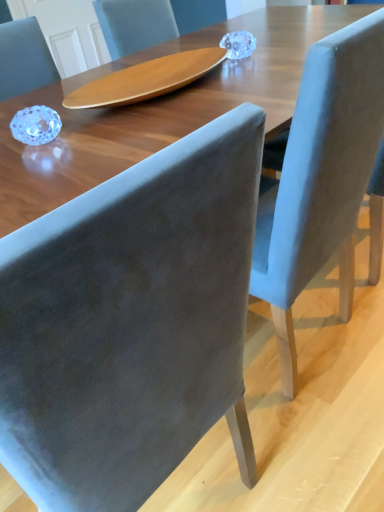
What do you see at coordinates (321, 178) in the screenshot?
I see `velvet blue chair at center, which ranks as the second chair in left-to-right order` at bounding box center [321, 178].

The height and width of the screenshot is (512, 384). What are the coordinates of `velvet blue chair at center, marked as the 1th chair in a right-to-left arrangement` in the screenshot? It's located at (321, 178).

The height and width of the screenshot is (512, 384). What do you see at coordinates (129, 321) in the screenshot?
I see `velvet gray chair at center, which is the 2th chair in right-to-left order` at bounding box center [129, 321].

This screenshot has height=512, width=384. I want to click on velvet gray chair at center, the 1th chair from the left, so click(x=129, y=321).

Where is `velvet blue chair at center, marked as the 1th chair in a right-to-left arrangement`? velvet blue chair at center, marked as the 1th chair in a right-to-left arrangement is located at coordinates (321, 178).

Which object is positioned more to the right, velvet blue chair at center, which ranks as the second chair in left-to-right order, or velvet gray chair at center, the 1th chair from the left?

From the viewer's perspective, velvet blue chair at center, which ranks as the second chair in left-to-right order, appears more on the right side.

Is the depth of velvet blue chair at center, which ranks as the second chair in left-to-right order, greater than that of velvet gray chair at center, the 1th chair from the left?

Yes, the depth of velvet blue chair at center, which ranks as the second chair in left-to-right order, is greater than that of velvet gray chair at center, the 1th chair from the left.

Is point (283, 249) positioned before point (88, 342)?

No, (283, 249) is further to viewer.

From the image's perspective, does velvet blue chair at center, which ranks as the second chair in left-to-right order, appear lower than velvet gray chair at center, the 1th chair from the left?

Actually, velvet blue chair at center, which ranks as the second chair in left-to-right order, appears above velvet gray chair at center, the 1th chair from the left, in the image.

From a real-world perspective, is velvet blue chair at center, which ranks as the second chair in left-to-right order, located beneath velvet gray chair at center, the 1th chair from the left?

Yes, from a real-world perspective, velvet blue chair at center, which ranks as the second chair in left-to-right order, is below velvet gray chair at center, the 1th chair from the left.

Which object is thinner, velvet blue chair at center, marked as the 1th chair in a right-to-left arrangement, or velvet gray chair at center, the 1th chair from the left?

velvet blue chair at center, marked as the 1th chair in a right-to-left arrangement.

Between velvet blue chair at center, which ranks as the second chair in left-to-right order, and velvet gray chair at center, which is the 2th chair in right-to-left order, which one has less height?

With less height is velvet blue chair at center, which ranks as the second chair in left-to-right order.

In terms of size, does velvet blue chair at center, which ranks as the second chair in left-to-right order, appear bigger or smaller than velvet gray chair at center, which is the 2th chair in right-to-left order?

Clearly, velvet blue chair at center, which ranks as the second chair in left-to-right order, is larger in size than velvet gray chair at center, which is the 2th chair in right-to-left order.

Would you say velvet blue chair at center, which ranks as the second chair in left-to-right order, is inside or outside velvet gray chair at center, the 1th chair from the left?

velvet blue chair at center, which ranks as the second chair in left-to-right order, is outside velvet gray chair at center, the 1th chair from the left.

Is velvet blue chair at center, marked as the 1th chair in a right-to-left arrangement, touching velvet gray chair at center, which is the 2th chair in right-to-left order?

No, velvet blue chair at center, marked as the 1th chair in a right-to-left arrangement, is not next to velvet gray chair at center, which is the 2th chair in right-to-left order.

Does velvet blue chair at center, which ranks as the second chair in left-to-right order, turn towards velvet gray chair at center, the 1th chair from the left?

No, velvet blue chair at center, which ranks as the second chair in left-to-right order, is not oriented towards velvet gray chair at center, the 1th chair from the left.

How different are the orientations of velvet blue chair at center, marked as the 1th chair in a right-to-left arrangement, and velvet gray chair at center, the 1th chair from the left, in degrees?

The facing directions of velvet blue chair at center, marked as the 1th chair in a right-to-left arrangement, and velvet gray chair at center, the 1th chair from the left, are 0.000313 degrees apart.

This screenshot has width=384, height=512. Find the location of `chair on the left of velvet blue chair at center, marked as the 1th chair in a right-to-left arrangement`. chair on the left of velvet blue chair at center, marked as the 1th chair in a right-to-left arrangement is located at coordinates (129, 321).

Which object is positioned more to the right, velvet gray chair at center, which is the 2th chair in right-to-left order, or velvet blue chair at center, which ranks as the second chair in left-to-right order?

From the viewer's perspective, velvet blue chair at center, which ranks as the second chair in left-to-right order, appears more on the right side.

Does velvet gray chair at center, which is the 2th chair in right-to-left order, come behind velvet blue chair at center, marked as the 1th chair in a right-to-left arrangement?

No, it is in front of velvet blue chair at center, marked as the 1th chair in a right-to-left arrangement.

Which is in front, point (117, 271) or point (382, 40)?

Point (117, 271)

From the image's perspective, does velvet gray chair at center, which is the 2th chair in right-to-left order, appear lower than velvet blue chair at center, marked as the 1th chair in a right-to-left arrangement?

Indeed, from the image's perspective, velvet gray chair at center, which is the 2th chair in right-to-left order, is shown beneath velvet blue chair at center, marked as the 1th chair in a right-to-left arrangement.

From a real-world perspective, is velvet gray chair at center, the 1th chair from the left, on velvet blue chair at center, marked as the 1th chair in a right-to-left arrangement?

Indeed, from a real-world perspective, velvet gray chair at center, the 1th chair from the left, stands above velvet blue chair at center, marked as the 1th chair in a right-to-left arrangement.

Considering the relative sizes of velvet gray chair at center, the 1th chair from the left, and velvet blue chair at center, marked as the 1th chair in a right-to-left arrangement, in the image provided, is velvet gray chair at center, the 1th chair from the left, wider than velvet blue chair at center, marked as the 1th chair in a right-to-left arrangement,?

Correct, the width of velvet gray chair at center, the 1th chair from the left, exceeds that of velvet blue chair at center, marked as the 1th chair in a right-to-left arrangement.

Between velvet gray chair at center, which is the 2th chair in right-to-left order, and velvet blue chair at center, which ranks as the second chair in left-to-right order, which one has less height?

Standing shorter between the two is velvet blue chair at center, which ranks as the second chair in left-to-right order.

Who is smaller, velvet gray chair at center, the 1th chair from the left, or velvet blue chair at center, which ranks as the second chair in left-to-right order?

Smaller between the two is velvet gray chair at center, the 1th chair from the left.

Is velvet gray chair at center, the 1th chair from the left, outside of velvet blue chair at center, which ranks as the second chair in left-to-right order?

velvet gray chair at center, the 1th chair from the left, is positioned outside velvet blue chair at center, which ranks as the second chair in left-to-right order.

Is velvet gray chair at center, the 1th chair from the left, not close to velvet blue chair at center, which ranks as the second chair in left-to-right order?

They are positioned close to each other.

Is velvet gray chair at center, which is the 2th chair in right-to-left order, positioned with its back to velvet blue chair at center, which ranks as the second chair in left-to-right order?

No, velvet gray chair at center, which is the 2th chair in right-to-left order, is not facing the opposite direction of velvet blue chair at center, which ranks as the second chair in left-to-right order.

What's the angular difference between velvet gray chair at center, the 1th chair from the left, and velvet blue chair at center, which ranks as the second chair in left-to-right order,'s facing directions?

0.000313 degrees.

How much distance is there between velvet gray chair at center, the 1th chair from the left, and velvet blue chair at center, which ranks as the second chair in left-to-right order?

velvet gray chair at center, the 1th chair from the left, and velvet blue chair at center, which ranks as the second chair in left-to-right order, are 16.79 inches apart.

Where is `chair on the right of velvet gray chair at center, which is the 2th chair in right-to-left order`? The width and height of the screenshot is (384, 512). chair on the right of velvet gray chair at center, which is the 2th chair in right-to-left order is located at coordinates (321, 178).

Where is `chair above the velvet gray chair at center, the 1th chair from the left (from the image's perspective)`? chair above the velvet gray chair at center, the 1th chair from the left (from the image's perspective) is located at coordinates (321, 178).

The image size is (384, 512). In order to click on chair located below the velvet blue chair at center, which ranks as the second chair in left-to-right order (from the image's perspective) in this screenshot , I will do `click(129, 321)`.